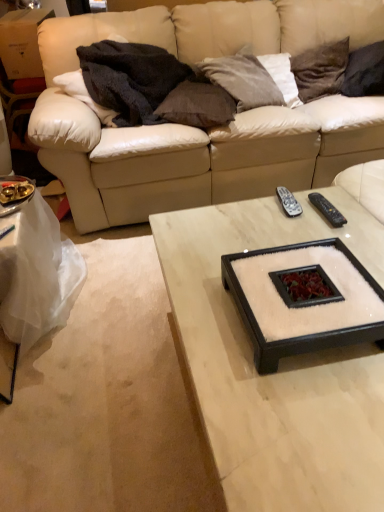
Question: Would you say brown fabric pillow at upper center, arranged as the 4th pillow when viewed from the right, is inside or outside dark brown velvet pillow at upper right, the 2th pillow viewed from the right?

Choices:
 (A) inside
 (B) outside

Answer: (B)

Question: From a real-world perspective, relative to dark brown velvet pillow at upper right, the 2th pillow viewed from the right, is brown fabric pillow at upper center, which ranks as the first pillow in left-to-right order, vertically above or below?

Choices:
 (A) above
 (B) below

Answer: (A)

Question: Which object is positioned closest to the black plastic remote control at center, the 2th remote control when ordered from right to left?

Choices:
 (A) beige leather couch at upper center
 (B) gray suede pillow at upper center, placed as the second pillow when sorted from left to right
 (C) dark gray fabric pillow at upper right, acting as the 4th pillow starting from the left
 (D) dark brown velvet pillow at upper right, the 2th pillow viewed from the right
 (E) black plastic remote control at right, marked as the first remote control in a right-to-left arrangement

Answer: (E)

Question: Which object is positioned closest to the dark brown velvet pillow at upper right, which appears as the 3th pillow when viewed from the left?

Choices:
 (A) black plastic remote control at center, the 2th remote control when ordered from right to left
 (B) dark fuzzy blanket at upper left
 (C) white felt square tray at center
 (D) gray suede pillow at upper center, the 3th pillow when ordered from right to left
 (E) white marble coffee table at lower left, which ranks as the second coffee table in right-to-left order

Answer: (D)